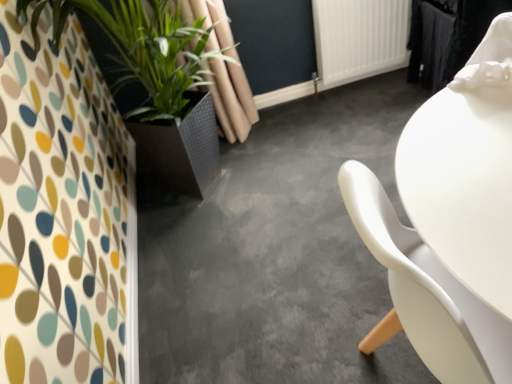
Question: Is white plastic radiator at upper center at the back of green leafy plant at left?

Choices:
 (A) no
 (B) yes

Answer: (A)

Question: Is the depth of green leafy plant at left less than that of white plastic radiator at upper center?

Choices:
 (A) yes
 (B) no

Answer: (A)

Question: From the image's perspective, is green leafy plant at left over white plastic radiator at upper center?

Choices:
 (A) yes
 (B) no

Answer: (B)

Question: Can you confirm if green leafy plant at left is wider than white plastic radiator at upper center?

Choices:
 (A) yes
 (B) no

Answer: (A)

Question: Is green leafy plant at left smaller than white plastic radiator at upper center?

Choices:
 (A) yes
 (B) no

Answer: (B)

Question: From a real-world perspective, is green leafy plant at left under white plastic radiator at upper center?

Choices:
 (A) no
 (B) yes

Answer: (A)

Question: Does green leafy plant at left have a smaller size compared to concretesmoothfloor at center?

Choices:
 (A) no
 (B) yes

Answer: (A)

Question: Is green leafy plant at left facing away from concretesmoothfloor at center?

Choices:
 (A) no
 (B) yes

Answer: (A)

Question: Considering the relative positions of green leafy plant at left and concretesmoothfloor at center in the image provided, is green leafy plant at left behind concretesmoothfloor at center?

Choices:
 (A) no
 (B) yes

Answer: (B)

Question: Does green leafy plant at left have a greater height compared to concretesmoothfloor at center?

Choices:
 (A) no
 (B) yes

Answer: (B)

Question: Is green leafy plant at left wider than concretesmoothfloor at center?

Choices:
 (A) no
 (B) yes

Answer: (A)

Question: Does green leafy plant at left lie in front of concretesmoothfloor at center?

Choices:
 (A) yes
 (B) no

Answer: (B)

Question: Would you say concretesmoothfloor at center is a long distance from green leafy plant at left?

Choices:
 (A) yes
 (B) no

Answer: (B)